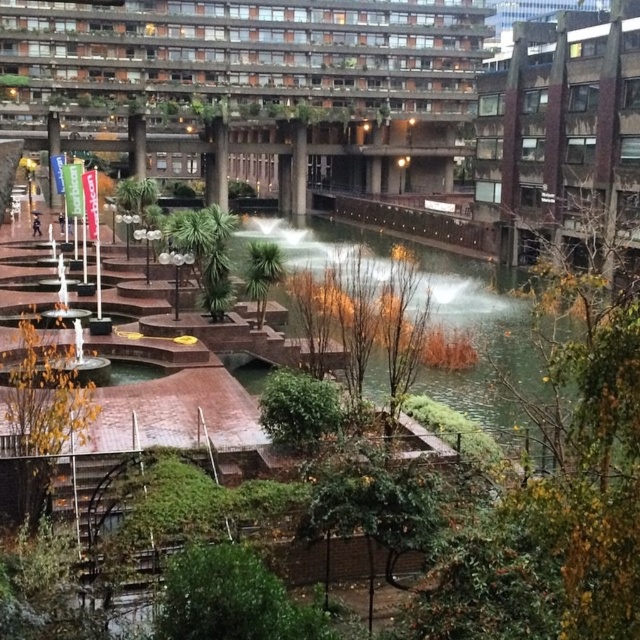
You are an architect assessing the urban space. You need to determine if the concrete fountain at left can be moved closer to the brown concrete building at upper right without overlapping. Given their widths, what should you consider?

The concrete fountain at left is wider than the brown concrete building at upper right. Therefore, when moving the concrete fountain at left closer to the brown concrete building at upper right, you must ensure there is sufficient space to accommodate its greater width to prevent overlap.

You are standing in the urban landscape scene and want to take a photo of the concrete fountain at left. If your camera has a maximum focus range of 15 meters, will it be able to capture the fountain clearly?

The concrete fountain at left is 14.92 meters from viewer, so yes, the camera can focus on it since the distance is within the 15 meter limit.

You are standing at the entrance of the building and want to locate the concrete fountain at left. Based on the coordinates provided, in which direction should you walk to reach it?

The concrete fountain at left is located at coordinates point (x=353, y=102), so you should walk to the left side of the scene to reach it.